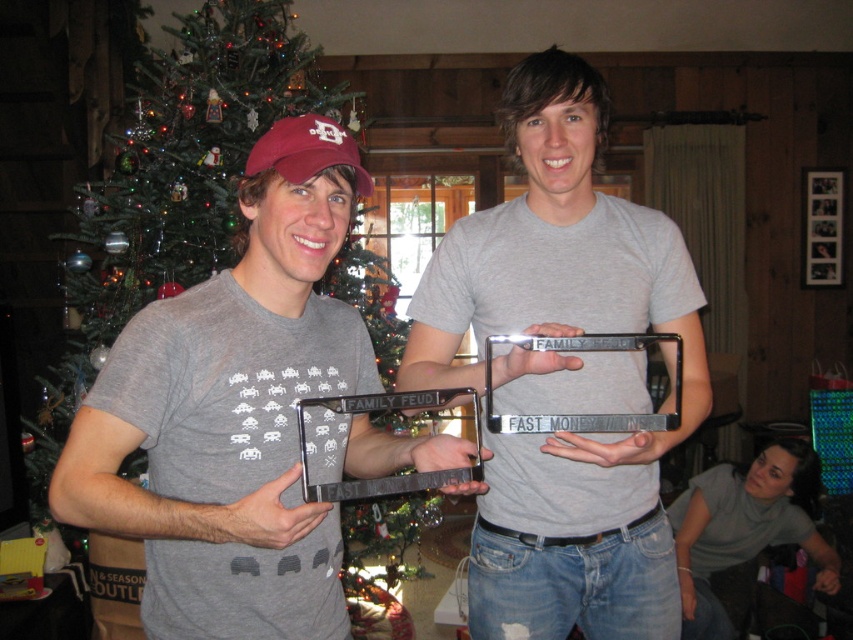
Question: Among these points, which one is farthest from the camera?

Choices:
 (A) (202, 180)
 (B) (576, 387)

Answer: (A)

Question: Which point is farther to the camera?

Choices:
 (A) gray cotton shirt at lower right
 (B) matte gray t-shirt at center
 (C) green matte christmas tree at upper left

Answer: (A)

Question: Can you confirm if green matte christmas tree at upper left is thinner than gray cotton shirt at lower right?

Choices:
 (A) yes
 (B) no

Answer: (B)

Question: Which object is closer to the camera taking this photo?

Choices:
 (A) gray cotton shirt at lower right
 (B) green matte christmas tree at upper left

Answer: (B)

Question: In this image, where is green matte christmas tree at upper left located relative to gray cotton shirt at lower right?

Choices:
 (A) above
 (B) below

Answer: (A)

Question: Is the position of matte gray t-shirt at center less distant than that of gray cotton shirt at lower right?

Choices:
 (A) no
 (B) yes

Answer: (B)